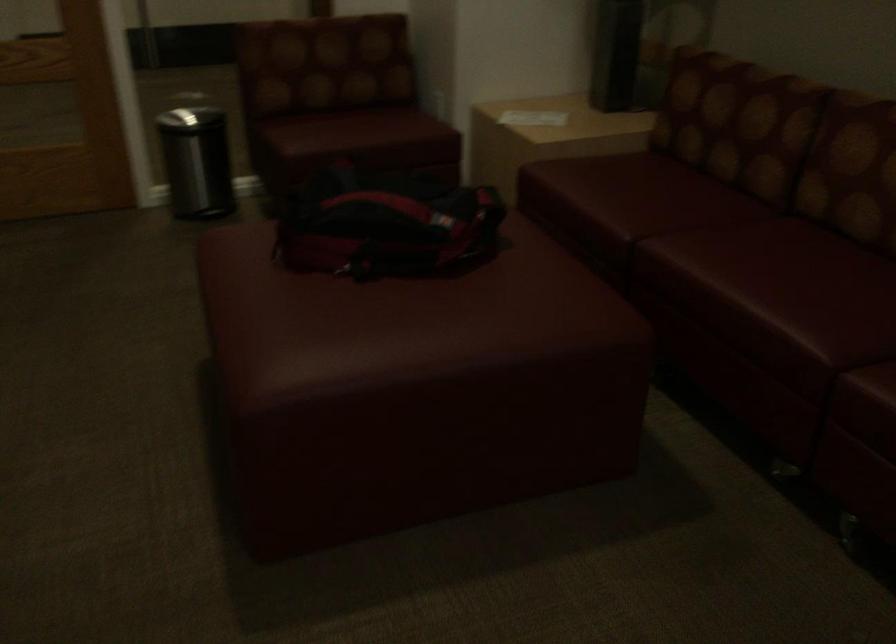
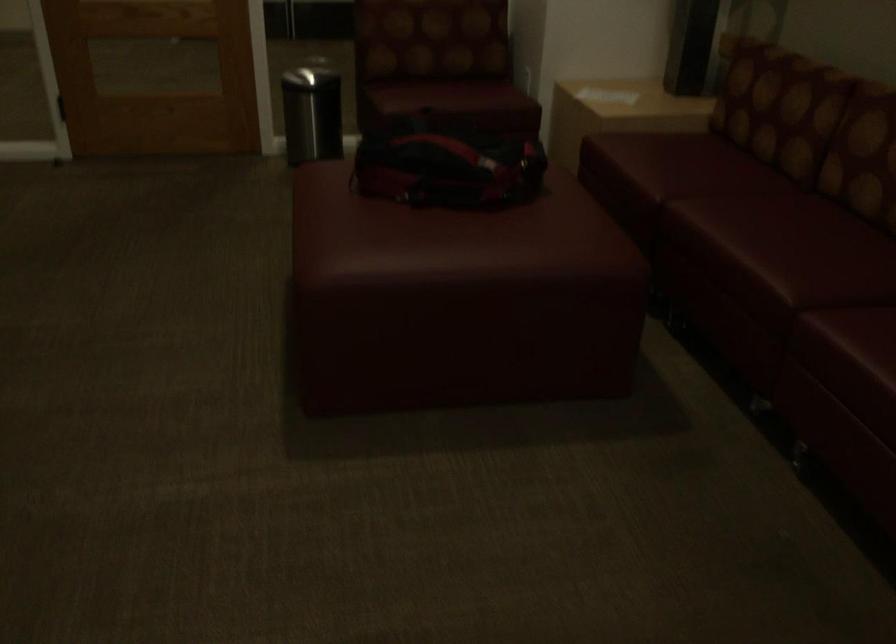
Find the pixel in the second image that matches [358,134] in the first image.

(448, 96)